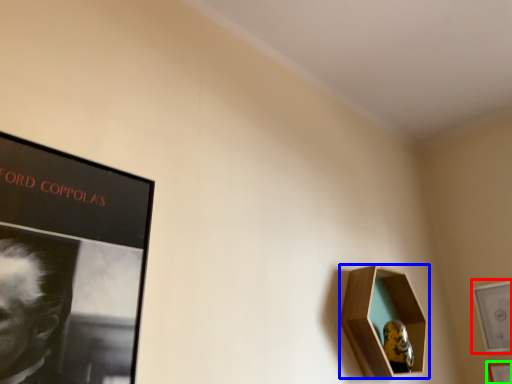
Question: Which object is positioned closest to picture frame (highlighted by a red box)? Select from picture frame (highlighted by a blue box) and picture frame (highlighted by a green box).

Choices:
 (A) picture frame
 (B) picture frame

Answer: (B)